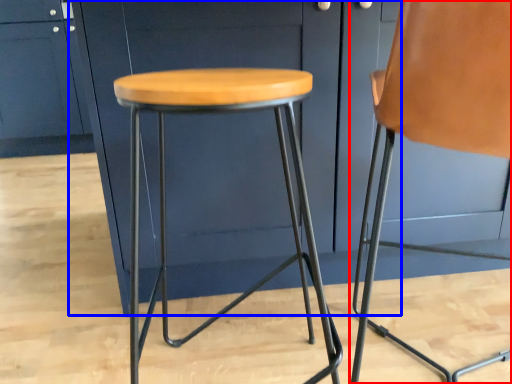
Question: Which object is further to the camera taking this photo, chair (highlighted by a red box) or cabinetry (highlighted by a blue box)?

Choices:
 (A) chair
 (B) cabinetry

Answer: (B)